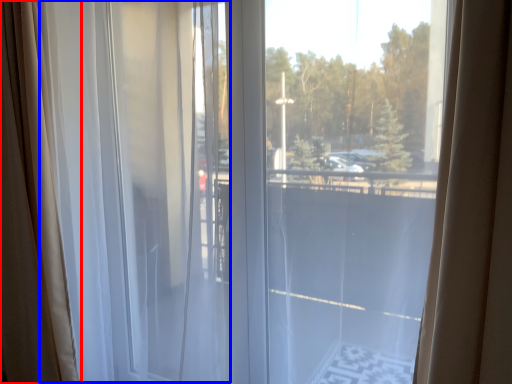
Question: Which object appears closest to the camera in this image, curtain (highlighted by a red box) or curtain (highlighted by a blue box)?

Choices:
 (A) curtain
 (B) curtain

Answer: (B)